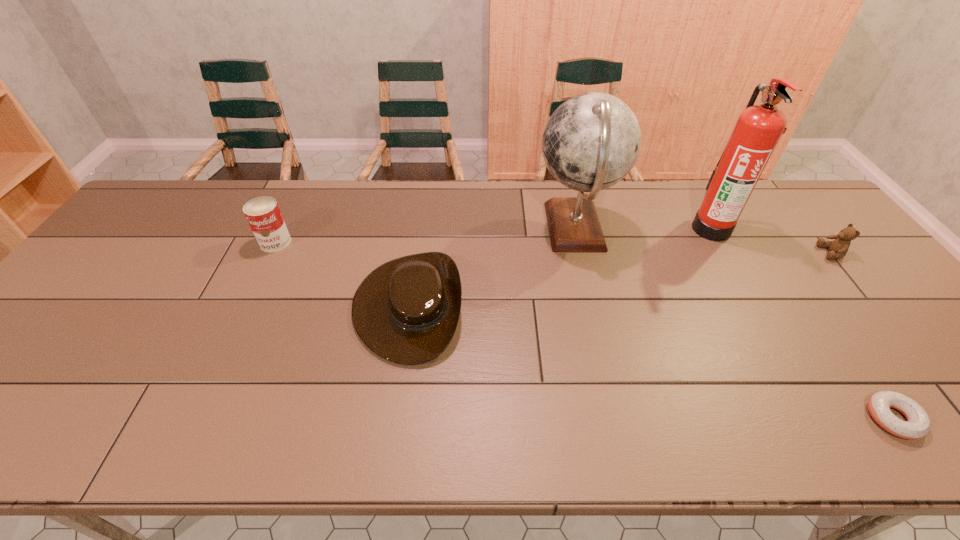
Where is `free spot between the doughnut and the globe`? This screenshot has height=540, width=960. free spot between the doughnut and the globe is located at coordinates (733, 323).

The height and width of the screenshot is (540, 960). In order to click on unoccupied position between the rightmost object and the cowboy hat in this screenshot , I will do `click(620, 279)`.

Identify the location of vacant area that lies between the cowboy hat and the second object from right to left. The image size is (960, 540). (651, 362).

The height and width of the screenshot is (540, 960). Identify the location of free space between the shortest object and the fourth object from right to left. (733, 323).

Locate an element on the screen. The image size is (960, 540). vacant space in between the fourth object from right to left and the fifth object from right to left is located at coordinates (492, 267).

What are the coordinates of `free space between the teddy bear and the third object from left to right` in the screenshot? It's located at (704, 241).

The height and width of the screenshot is (540, 960). I want to click on vacant area between the teddy bear and the fifth object from right to left, so click(x=620, y=279).

Find the location of `empty location between the teddy bear and the doughnut`. empty location between the teddy bear and the doughnut is located at coordinates (862, 335).

Locate an element on the screen. free space between the fire extinguisher and the second object from right to left is located at coordinates (803, 323).

Find the location of a particular element. The image size is (960, 540). object identified as the closest to the fifth object from right to left is located at coordinates (591, 142).